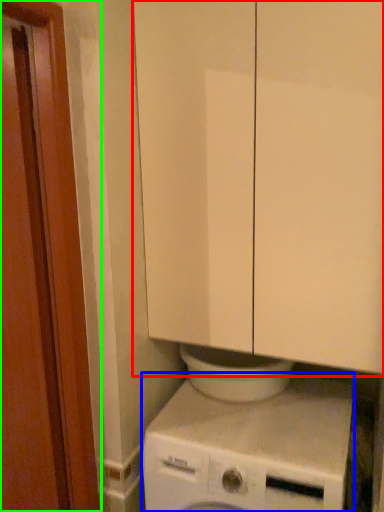
Question: Which is farther away from cabinetry (highlighted by a red box)? washing machine (highlighted by a blue box) or screen door (highlighted by a green box)?

Choices:
 (A) washing machine
 (B) screen door

Answer: (A)